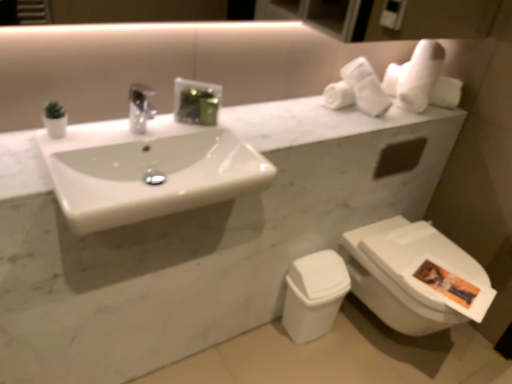
This screenshot has height=384, width=512. What are the coordinates of `free region on the left part of white plastic toilet bowl at lower right` in the screenshot? It's located at (257, 340).